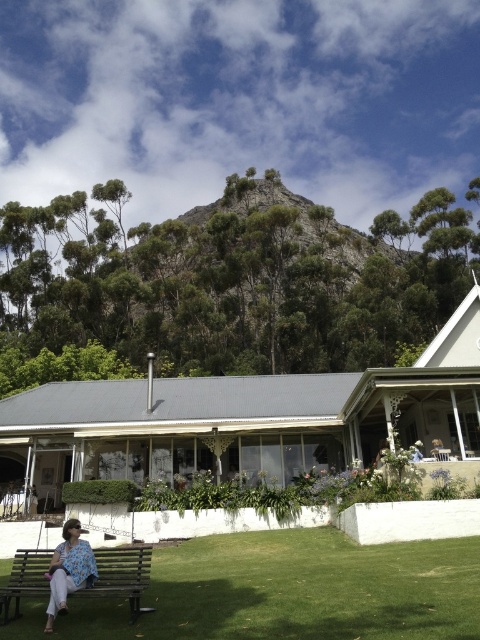
You are standing at the point marked by the coordinates point (x=295, y=589). Looking towards the house, which direction should you walk to reach the wooden bench where the person is sitting?

The point (x=295, y=589) marks green grass at lower left. To reach the wooden bench from there, you should walk north towards the house.

You are standing in the garden and want to sit down on the wooden bench at lower left. However, there is a floral fabric dress at lower left in your way. Which object is closer to you so you can step around it?

The wooden bench at lower left is closer to you than the floral fabric dress at lower left, so you should step around the wooden bench at lower left first.